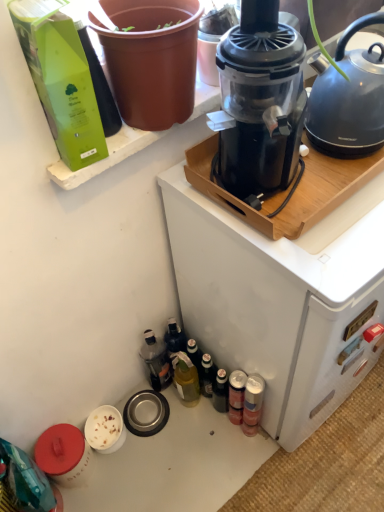
Where is `free location in front of metallic silver can at lower right, which is the 4th bottle in left-to-right order`? free location in front of metallic silver can at lower right, which is the 4th bottle in left-to-right order is located at coordinates (258, 476).